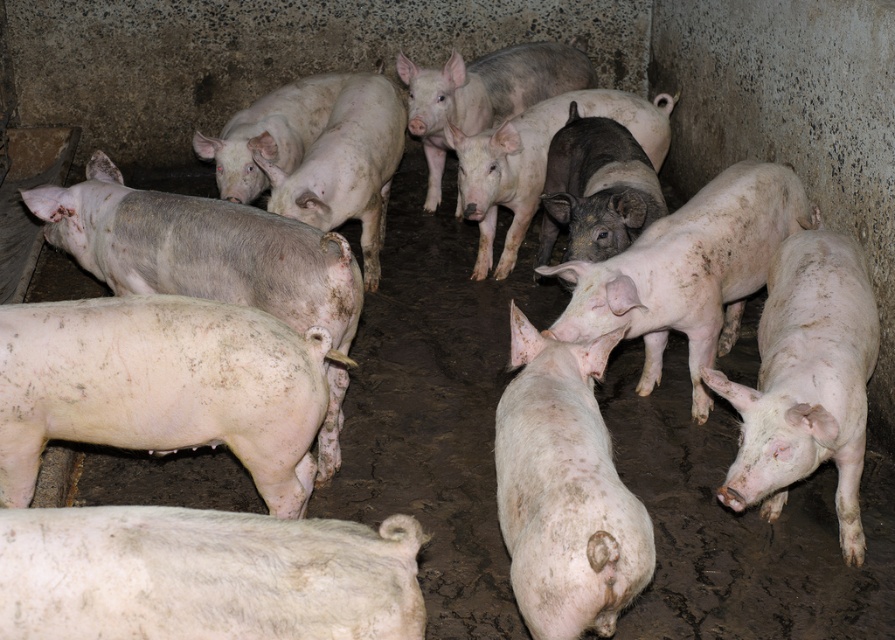
Question: Is white matte pig at lower left positioned before white matte pig at center?

Choices:
 (A) yes
 (B) no

Answer: (A)

Question: Which object appears farthest from the camera in this image?

Choices:
 (A) white matte pig at right
 (B) white matte pig at center
 (C) dirty white pig at center

Answer: (C)

Question: Considering the relative positions of white matte pig at lower left and white matte pig at center in the image provided, where is white matte pig at lower left located with respect to white matte pig at center?

Choices:
 (A) above
 (B) below

Answer: (B)

Question: Can you confirm if white matte pig at lower left is positioned to the right of white matte pig at right?

Choices:
 (A) yes
 (B) no

Answer: (B)

Question: Which of the following is the farthest from the observer?

Choices:
 (A) dirty white pig at center
 (B) white matte pig at lower left

Answer: (A)

Question: Among these objects, which one is nearest to the camera?

Choices:
 (A) white matte pig at right
 (B) white matte pig at center

Answer: (B)